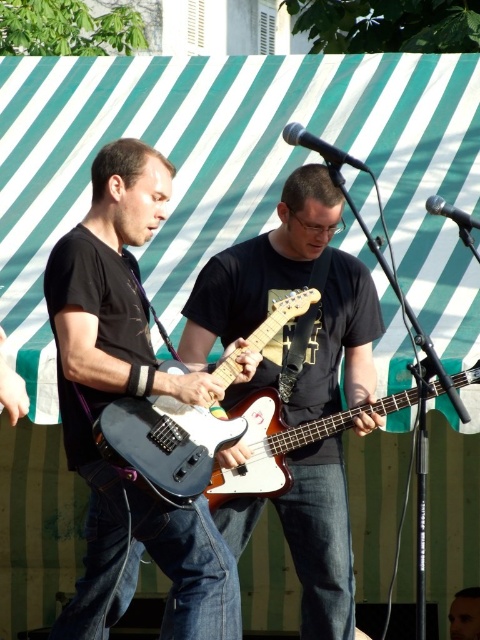
Question: Considering the real-world distances, which object is closest to the smooth skin face at center?

Choices:
 (A) white glossy bass guitar at center
 (B) matte black electric guitar at center
 (C) matte black guitar at center
 (D) matte black guitar at left

Answer: (A)

Question: In this image, where is matte black guitar at center located relative to smooth skin face at center?

Choices:
 (A) below
 (B) above

Answer: (B)

Question: Is matte black guitar at center further to the viewer compared to white glossy bass guitar at center?

Choices:
 (A) yes
 (B) no

Answer: (A)

Question: Does white glossy bass guitar at center have a larger size compared to smooth skin face at center?

Choices:
 (A) no
 (B) yes

Answer: (B)

Question: Among these points, which one is nearest to the camera?

Choices:
 (A) (182, 449)
 (B) (300, 422)
 (C) (134, 579)
 (D) (216, 280)

Answer: (A)

Question: Which object appears closest to the camera in this image?

Choices:
 (A) smooth skin face at center
 (B) white glossy bass guitar at center
 (C) matte black guitar at left
 (D) matte black guitar at center

Answer: (C)